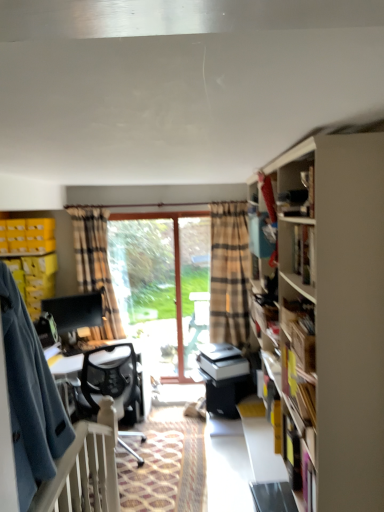
Question: Does white plastic balustrade at lower left have a lesser width compared to yellow plastic crate at left, the second cabinet ordered from the bottom?

Choices:
 (A) no
 (B) yes

Answer: (B)

Question: Is white plastic balustrade at lower left closer to camera compared to yellow plastic crate at left, which ranks as the first cabinet in top-to-bottom order?

Choices:
 (A) yes
 (B) no

Answer: (A)

Question: From a real-world perspective, is white plastic balustrade at lower left below yellow plastic crate at left, the second cabinet ordered from the bottom?

Choices:
 (A) no
 (B) yes

Answer: (B)

Question: Is white plastic balustrade at lower left further to camera compared to yellow plastic crate at left, which ranks as the first cabinet in top-to-bottom order?

Choices:
 (A) yes
 (B) no

Answer: (B)

Question: Does white plastic balustrade at lower left have a larger size compared to yellow plastic crate at left, the second cabinet ordered from the bottom?

Choices:
 (A) no
 (B) yes

Answer: (B)

Question: Does white plastic balustrade at lower left have a smaller size compared to yellow plastic crate at left, the second cabinet ordered from the bottom?

Choices:
 (A) no
 (B) yes

Answer: (A)

Question: Is plaid fabric curtain at center looking in the opposite direction of white mesh chair at center?

Choices:
 (A) yes
 (B) no

Answer: (B)

Question: Does plaid fabric curtain at center have a lesser width compared to white mesh chair at center?

Choices:
 (A) yes
 (B) no

Answer: (A)

Question: Is plaid fabric curtain at center placed right next to white mesh chair at center?

Choices:
 (A) no
 (B) yes

Answer: (A)

Question: Does plaid fabric curtain at center have a greater width compared to white mesh chair at center?

Choices:
 (A) no
 (B) yes

Answer: (A)

Question: From a real-world perspective, is plaid fabric curtain at center below white mesh chair at center?

Choices:
 (A) yes
 (B) no

Answer: (B)

Question: From the image's perspective, is plaid fabric curtain at center on white mesh chair at center?

Choices:
 (A) yes
 (B) no

Answer: (A)

Question: Is matte black bookshelf at upper right located within white plastic balustrade at lower left?

Choices:
 (A) yes
 (B) no

Answer: (B)